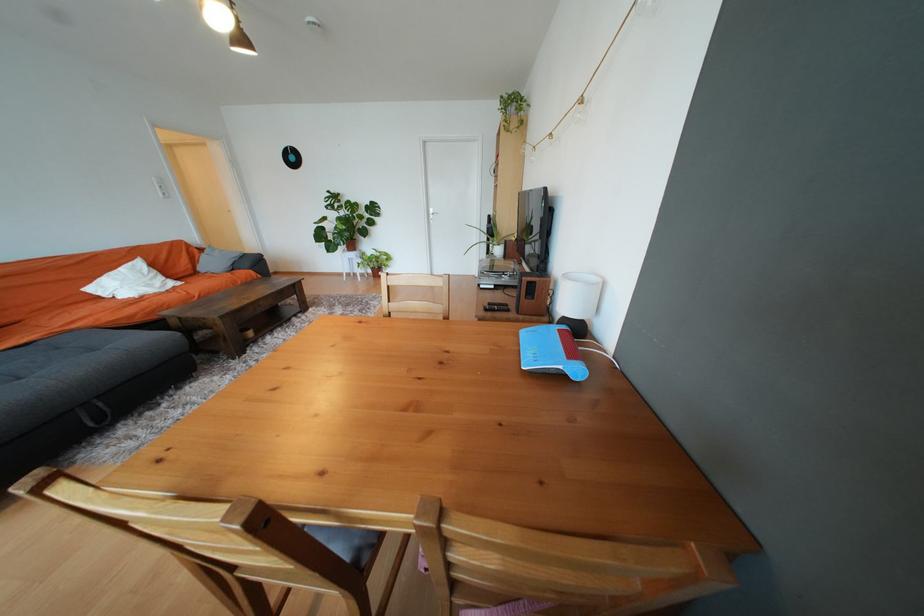
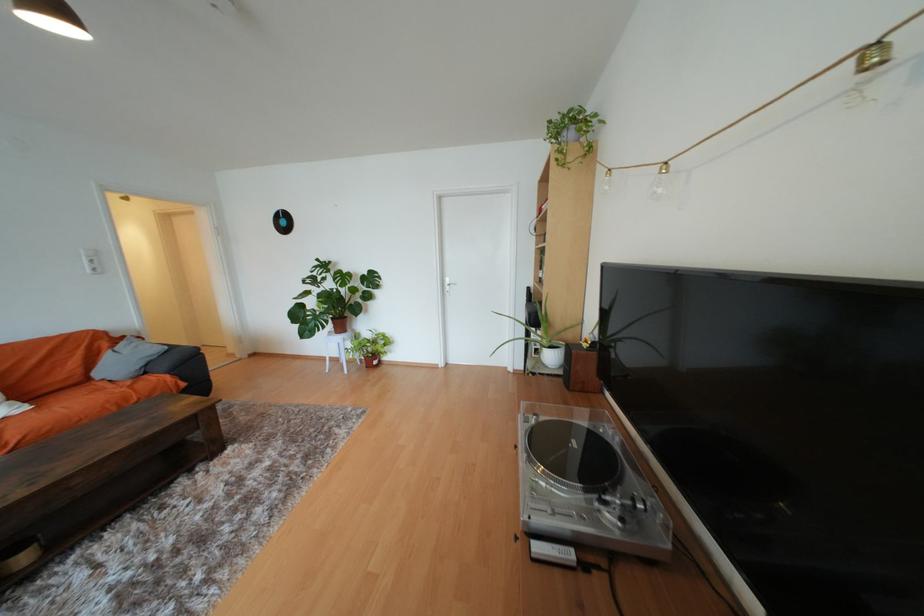
The point at (504, 253) is marked in the first image. Where is the corresponding point in the second image?

(556, 359)